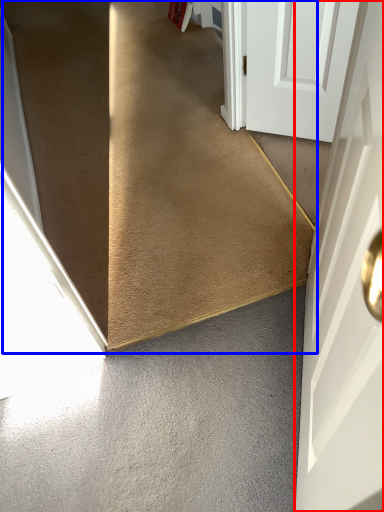
Question: Which of the following is the farthest to the observer, door (highlighted by a red box) or stairs (highlighted by a blue box)?

Choices:
 (A) door
 (B) stairs

Answer: (B)